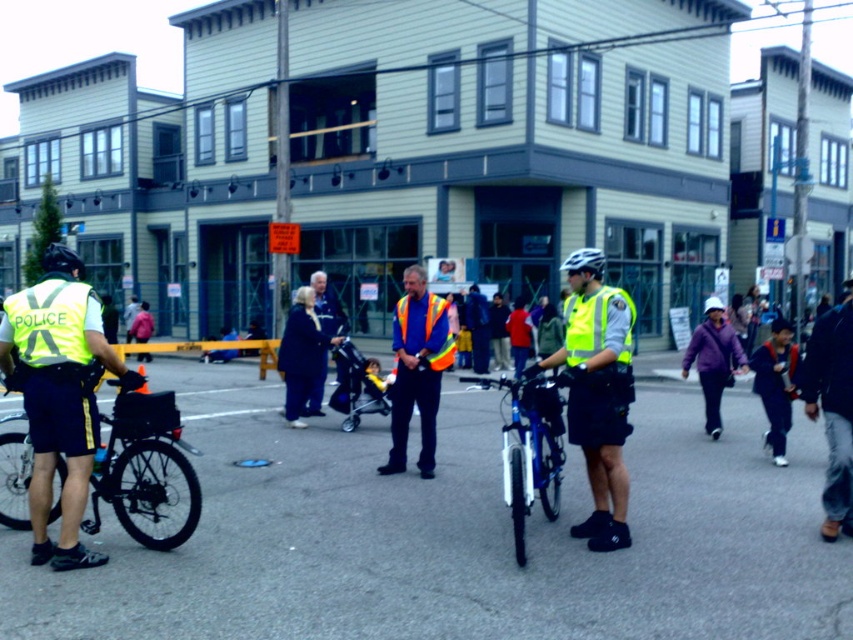
Question: Among these points, which one is farthest from the camera?

Choices:
 (A) (733, 365)
 (B) (412, 397)
 (C) (787, 396)

Answer: (A)

Question: Is reflective yellow vest at center thinner than black matte bicycle at left?

Choices:
 (A) no
 (B) yes

Answer: (B)

Question: Considering the real-world distances, which object is closest to the orange reflective vest at center?

Choices:
 (A) dark blue jeans at center
 (B) dark blue fabric coat at center
 (C) high-visibility yellow vest at left
 (D) shiny blue bicycle at center

Answer: (B)

Question: Does high-visibility yellow vest at left have a greater width compared to black matte bicycle at left?

Choices:
 (A) yes
 (B) no

Answer: (B)

Question: Does dark blue fabric coat at center appear under purple fleece jacket at lower right?

Choices:
 (A) yes
 (B) no

Answer: (A)

Question: Which of the following is the closest to the observer?

Choices:
 (A) (683, 356)
 (B) (45, 540)

Answer: (B)